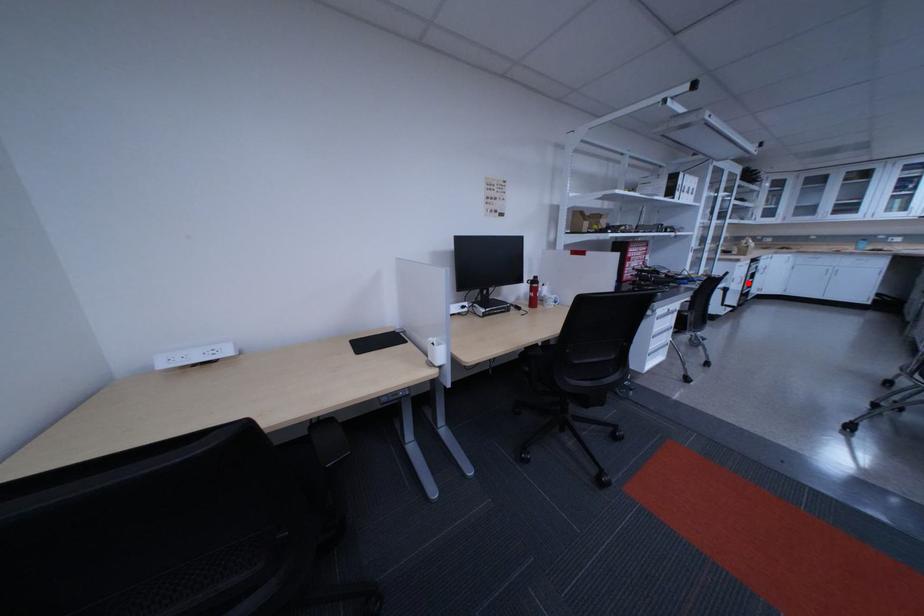
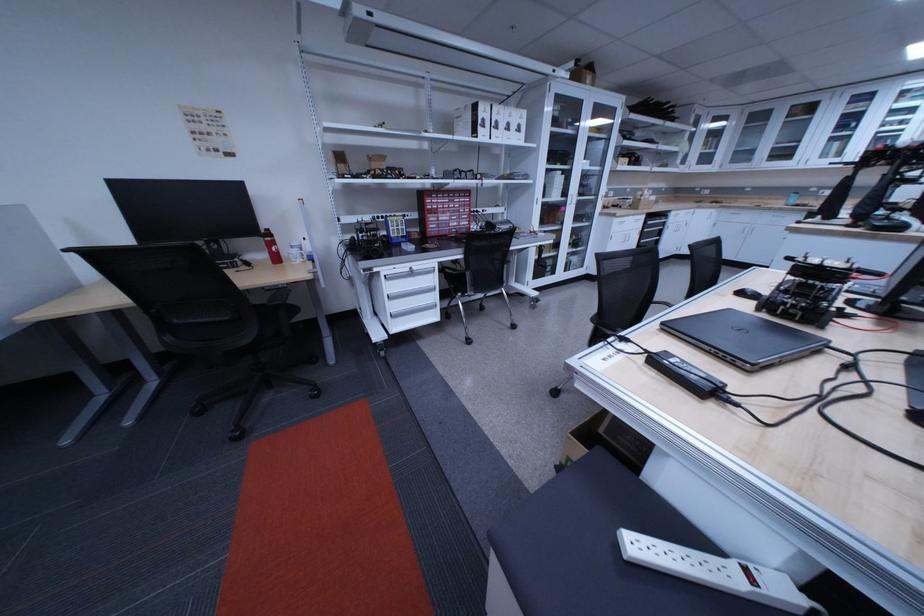
Find the pixel in the second image that matches the highlighted location in the first image.

(626, 241)